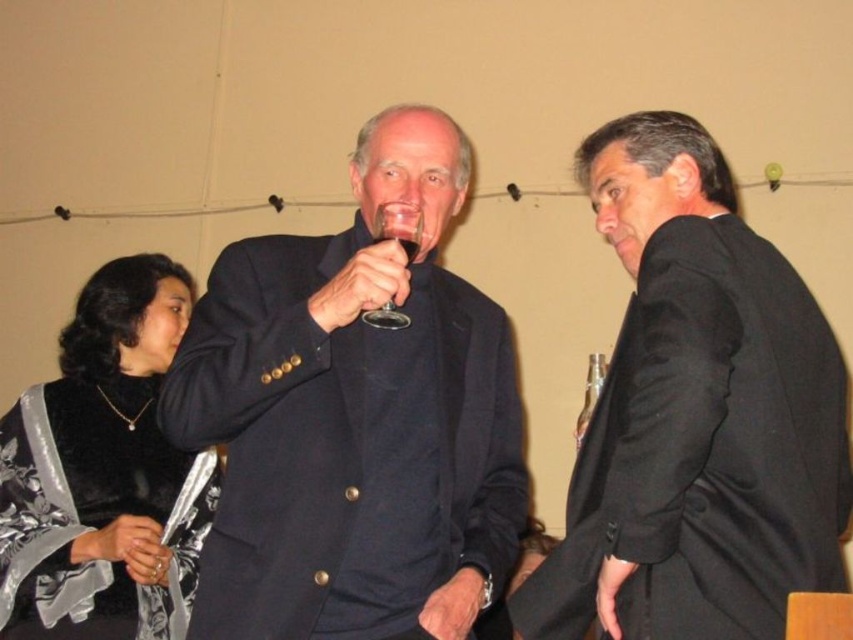
Between black satin suit at right and clear glass wine at center, which one has less height?

clear glass wine at center

Which is more to the right, black satin suit at right or clear glass wine at center?

black satin suit at right

Is point (563, 621) farther from camera compared to point (416, 243)?

No, it is in front of (416, 243).

Identify the location of black satin suit at right. (695, 413).

Who is shorter, matte black suit at center or velvet black dress at lower left?

velvet black dress at lower left

Who is more distant from viewer, [325,301] or [80,541]?

Positioned behind is point [80,541].

Identify the location of matte black suit at center. (354, 419).

Which is above, black satin suit at right or transparent glass at center?

transparent glass at center

Consider the image. Is black satin suit at right to the left of transparent glass at center from the viewer's perspective?

Incorrect, black satin suit at right is not on the left side of transparent glass at center.

Who is more forward, (665, 150) or (419, 216)?

Point (665, 150) is more forward.

Where is `black satin suit at right`? black satin suit at right is located at coordinates (695, 413).